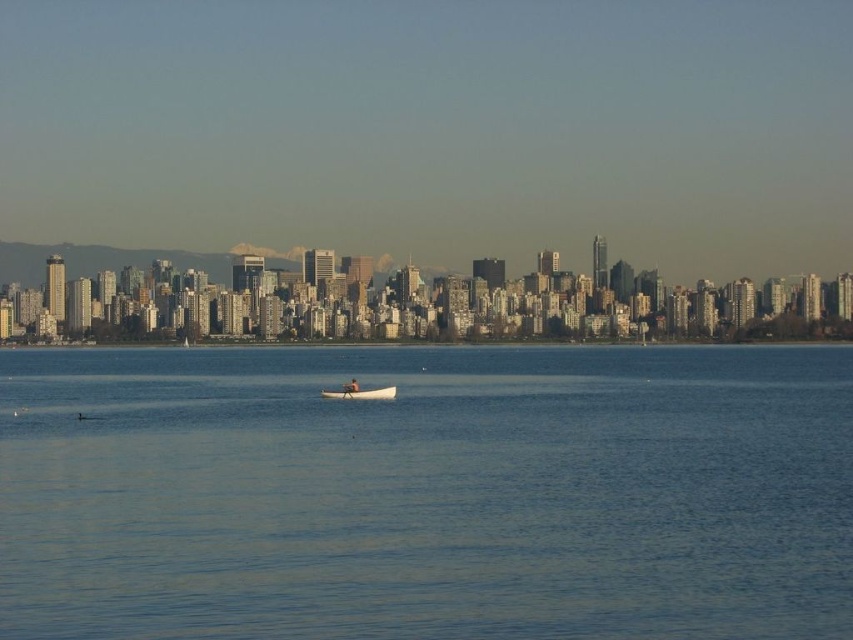
Question: Is clear blue water at center above white wood boat at center?

Choices:
 (A) no
 (B) yes

Answer: (A)

Question: Which point is closer to the camera?

Choices:
 (A) clear blue water at center
 (B) white wood boat at center

Answer: (A)

Question: Can you confirm if clear blue water at center is thinner than white wood boat at center?

Choices:
 (A) no
 (B) yes

Answer: (A)

Question: Does clear blue water at center have a larger size compared to white wood boat at center?

Choices:
 (A) yes
 (B) no

Answer: (A)

Question: Which point appears farthest from the camera in this image?

Choices:
 (A) (373, 388)
 (B) (657, 497)

Answer: (B)